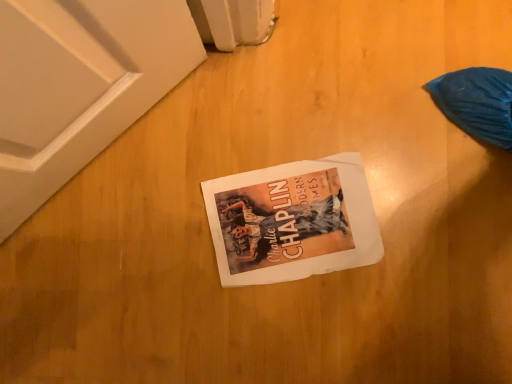
The height and width of the screenshot is (384, 512). What do you see at coordinates (292, 221) in the screenshot? I see `white paper book at center` at bounding box center [292, 221].

Where is `white paper book at center`? This screenshot has width=512, height=384. white paper book at center is located at coordinates (292, 221).

Image resolution: width=512 pixels, height=384 pixels. Find the location of `white paper book at center`. white paper book at center is located at coordinates (292, 221).